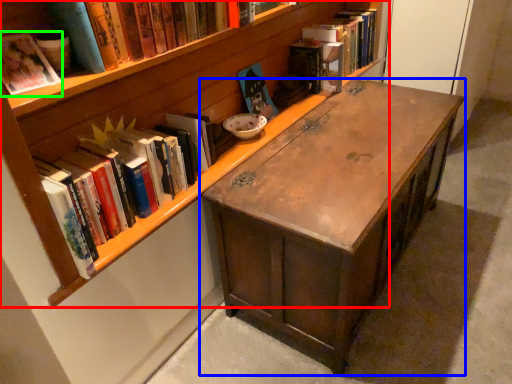
Question: Based on their relative distances, which object is farther from bookcase (highlighted by a red box)? Choose from desk (highlighted by a blue box) and book (highlighted by a green box).

Choices:
 (A) desk
 (B) book

Answer: (B)